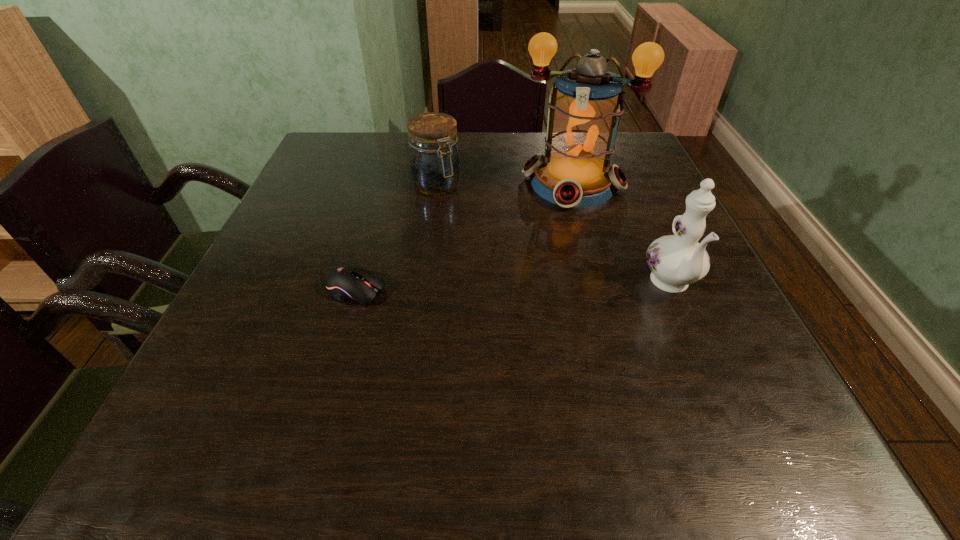
This screenshot has width=960, height=540. Identify the location of the leftmost object. 345,283.

Identify the location of computer mouse. 345,283.

The image size is (960, 540). I want to click on the second tallest object, so coord(676,261).

Locate an element on the screen. This screenshot has width=960, height=540. lantern is located at coordinates (575, 172).

This screenshot has width=960, height=540. Identify the location of the second object from left to right. (434, 160).

At what (x,y) coordinates should I click in order to perform the action: click on the second shortest object. Please return your answer as a coordinate pair (x, y). Looking at the image, I should click on (434, 160).

The height and width of the screenshot is (540, 960). I want to click on vacant space located 0.160m on the left of the leftmost object, so click(x=246, y=290).

Find the location of a particular element. Image resolution: width=960 pixels, height=540 pixels. vacant area located 0.130m at the spout of the chinaware is located at coordinates (709, 372).

At what (x,y) coordinates should I click in order to perform the action: click on free location located 0.200m on the front-facing side of the lantern. Please return your answer as a coordinate pair (x, y). The width and height of the screenshot is (960, 540). Looking at the image, I should click on pyautogui.click(x=546, y=265).

Identify the location of blank space located on the front-facing side of the lantern. The height and width of the screenshot is (540, 960). (523, 336).